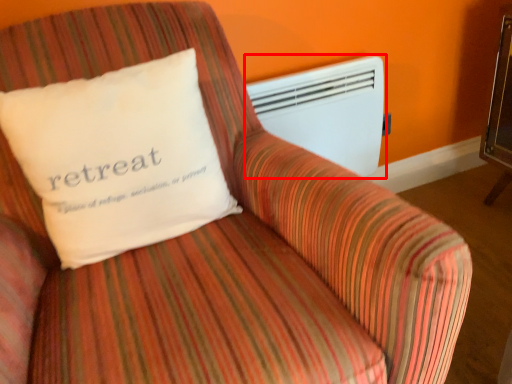
Question: From the image's perspective, what is the correct spatial positioning of air conditioning (annotated by the red box) in reference to pillow?

Choices:
 (A) above
 (B) below

Answer: (A)